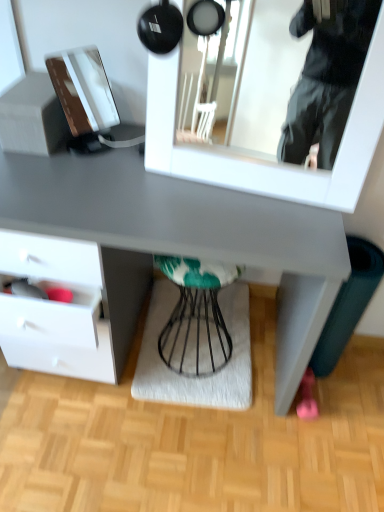
I want to click on free location in front of teal fabric stool at center, so click(196, 391).